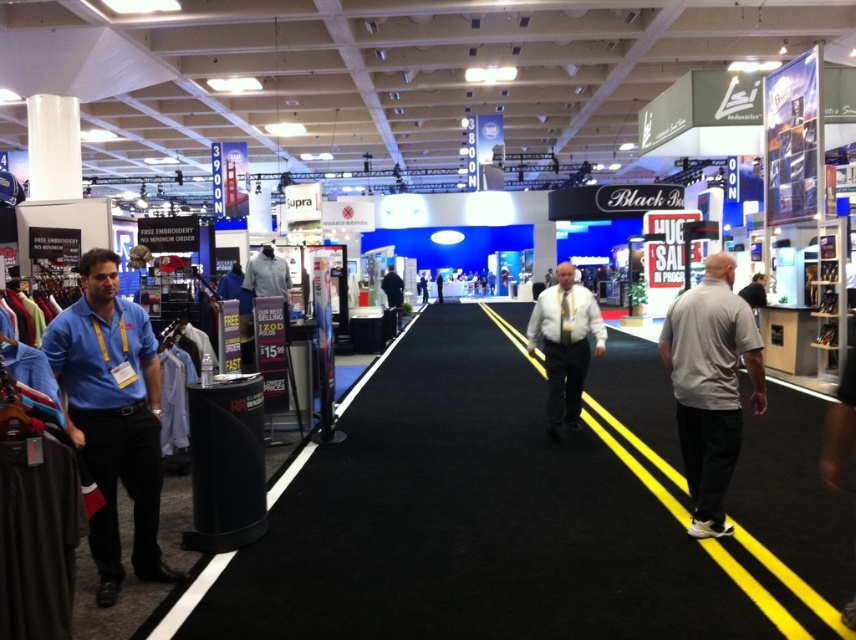
Between blue cotton shirt at left and gray matte shirt at right, which one appears on the right side from the viewer's perspective?

From the viewer's perspective, gray matte shirt at right appears more on the right side.

Measure the distance between blue cotton shirt at left and gray matte shirt at right.

3.33 meters

Identify the location of blue cotton shirt at left. The image size is (856, 640). (111, 416).

Describe the element at coordinates (111, 416) in the screenshot. I see `blue cotton shirt at left` at that location.

Is blue cotton shirt at left shorter than gray fabric polo shirt at center?

In fact, blue cotton shirt at left may be taller than gray fabric polo shirt at center.

Find the location of a particular element. The height and width of the screenshot is (640, 856). blue cotton shirt at left is located at coordinates (111, 416).

Looking at this image, which of these two, gray matte shirt at right or white shirt at center, stands taller?

gray matte shirt at right

Looking at this image, does gray matte shirt at right have a lesser height compared to white shirt at center?

In fact, gray matte shirt at right may be taller than white shirt at center.

This screenshot has width=856, height=640. In order to click on gray matte shirt at right in this screenshot , I will do 710,385.